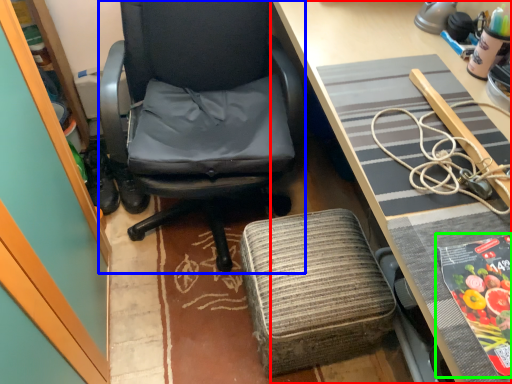
Question: Considering the real-world distances, which object is closest to desk (highlighted by a red box)? chair (highlighted by a blue box) or paperback book (highlighted by a green box).

Choices:
 (A) chair
 (B) paperback book

Answer: (B)